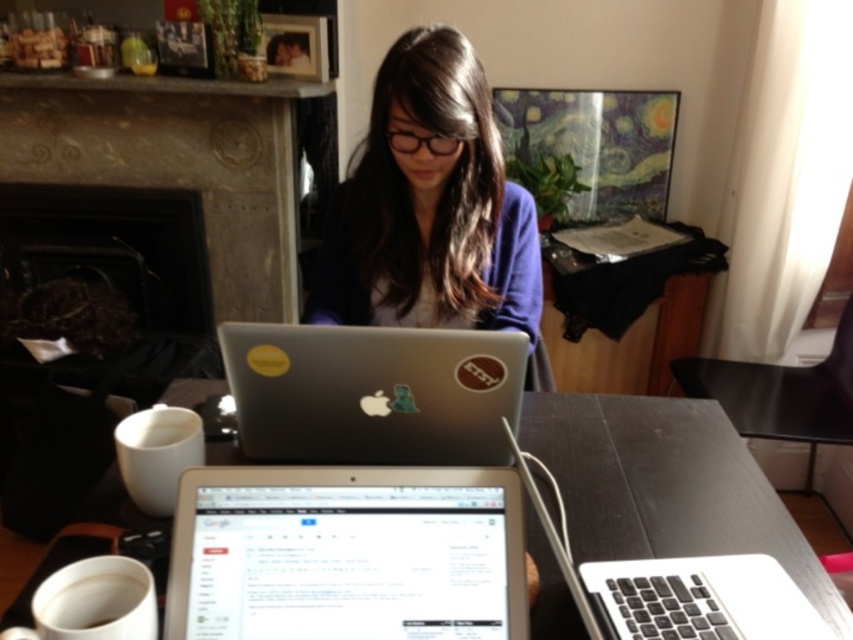
You are organizing a small event and need to place a decorative tray on the table. Considering the objects present, will the matte purple sweater at center fit entirely on the black matte table at center without hanging over the edges?

The matte purple sweater at center has a larger width than the black matte table at center, so it will not fit entirely on the table without hanging over the edges.

You are a delivery robot with a 3.5 feet wide package. You need to place it on the table where the matte purple sweater at center is located. Is there enough space between the sweater and the edge of the table to safely place the package?

The distance between the matte purple sweater at center and the camera is 3.65 feet, but this measurement does not directly indicate the available space on the table. The question requires knowing the distance from the sweater to the table edge, which is not provided in the object description. Therefore, it is impossible to determine if the package will fit without additional information.

You are organizing the items on the table and want to place the white matte cup at lower left in front of the matte purple sweater at center. Is this currently possible without moving the sweater?

The white matte cup at lower left is currently behind the matte purple sweater at center. To place it in front, you would need to move the sweater first, so it is not possible without moving the sweater.